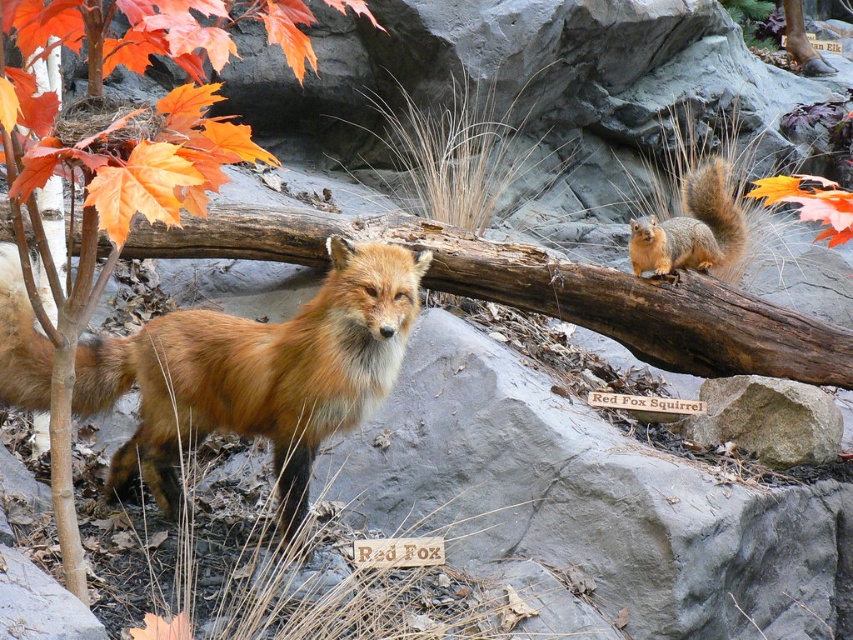
You are a bird flying over the diorama scene. You notice an orange leafy tree at lower left and a fuzzy brown tail at lower left. Which object is positioned higher from the ground?

The orange leafy tree at lower left is positioned higher from the ground than the fuzzy brown tail at lower left.

You are a small animal trying to cross from the orange leafy tree at lower left to the fuzzy brown tail at lower left. Given that your maximum jumping distance is 25 inches, will you be able to make the jump?

The orange leafy tree at lower left is 27.12 inches away from the fuzzy brown tail at lower left. Since your maximum jumping distance is 25 inches, you will not be able to make the jump.